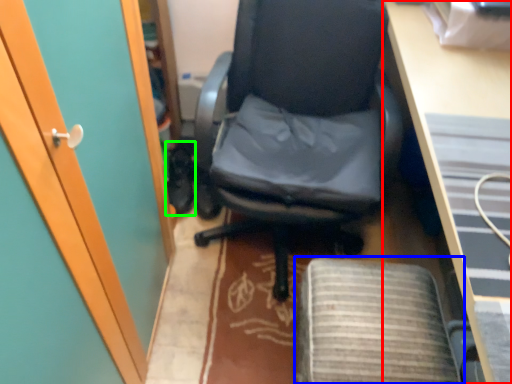
Question: Which object is positioned farthest from desk (highlighted by a red box)? Select from computer chair (highlighted by a blue box) and footwear (highlighted by a green box).

Choices:
 (A) computer chair
 (B) footwear

Answer: (B)